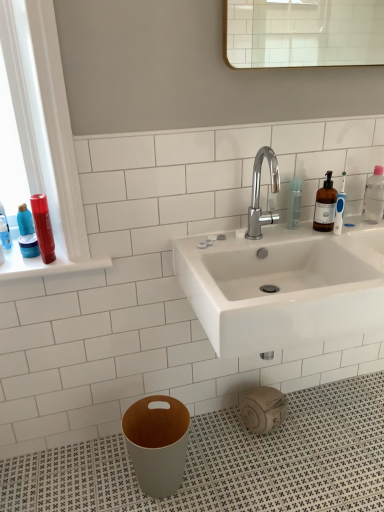
Question: Does chrome metallic faucet at center come behind clear plastic bottle at upper right?

Choices:
 (A) no
 (B) yes

Answer: (A)

Question: Does chrome metallic faucet at center appear on the left side of clear plastic bottle at upper right?

Choices:
 (A) yes
 (B) no

Answer: (A)

Question: From the image's perspective, would you say chrome metallic faucet at center is shown under clear plastic bottle at upper right?

Choices:
 (A) yes
 (B) no

Answer: (B)

Question: Is chrome metallic faucet at center closer to camera compared to clear plastic bottle at upper right?

Choices:
 (A) yes
 (B) no

Answer: (A)

Question: Would you say chrome metallic faucet at center is a long distance from clear plastic bottle at upper right?

Choices:
 (A) yes
 (B) no

Answer: (B)

Question: Relative to white glossy sink at center, is shiny red hair spray at left in front or behind?

Choices:
 (A) behind
 (B) front

Answer: (A)

Question: Is shiny red hair spray at left bigger or smaller than white glossy sink at center?

Choices:
 (A) big
 (B) small

Answer: (B)

Question: From a real-world perspective, is shiny red hair spray at left above or below white glossy sink at center?

Choices:
 (A) below
 (B) above

Answer: (B)

Question: Is shiny red hair spray at left inside or outside of white glossy sink at center?

Choices:
 (A) inside
 (B) outside

Answer: (B)

Question: From a real-world perspective, is white glossy sink at center above or below chrome metallic faucet at center?

Choices:
 (A) below
 (B) above

Answer: (A)

Question: Is point (370, 256) closer or farther from the camera than point (259, 150)?

Choices:
 (A) farther
 (B) closer

Answer: (B)

Question: From the image's perspective, is white glossy sink at center located above or below chrome metallic faucet at center?

Choices:
 (A) above
 (B) below

Answer: (B)

Question: Is white glossy sink at center in front of or behind chrome metallic faucet at center in the image?

Choices:
 (A) behind
 (B) front

Answer: (B)

Question: Is clear plastic bottle at upper right in front of or behind clear plastic bottle at right in the image?

Choices:
 (A) behind
 (B) front

Answer: (B)

Question: Is clear plastic bottle at upper right wider or thinner than clear plastic bottle at right?

Choices:
 (A) wide
 (B) thin

Answer: (B)